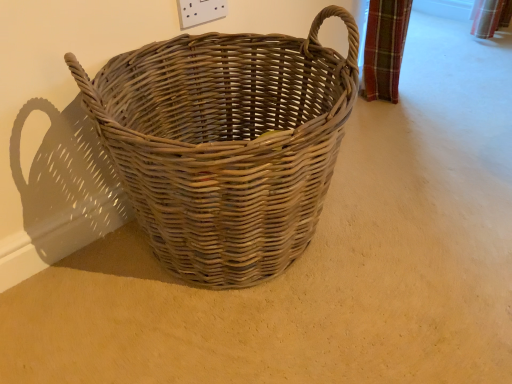
Identify the location of natural wicker basket at center. The image size is (512, 384). pos(225,144).

In order to face natural wicker basket at center, should I rotate leftwards or rightwards?

To face it directly, rotate left by 4.005 degrees.

Describe the element at coordinates (225, 144) in the screenshot. The width and height of the screenshot is (512, 384). I see `natural wicker basket at center` at that location.

Where is `natural wicker basket at center`? The image size is (512, 384). natural wicker basket at center is located at coordinates (225, 144).